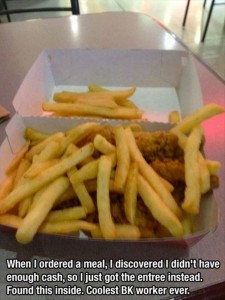
The height and width of the screenshot is (300, 225). In order to click on chair in this screenshot , I will do `click(68, 3)`, `click(204, 29)`.